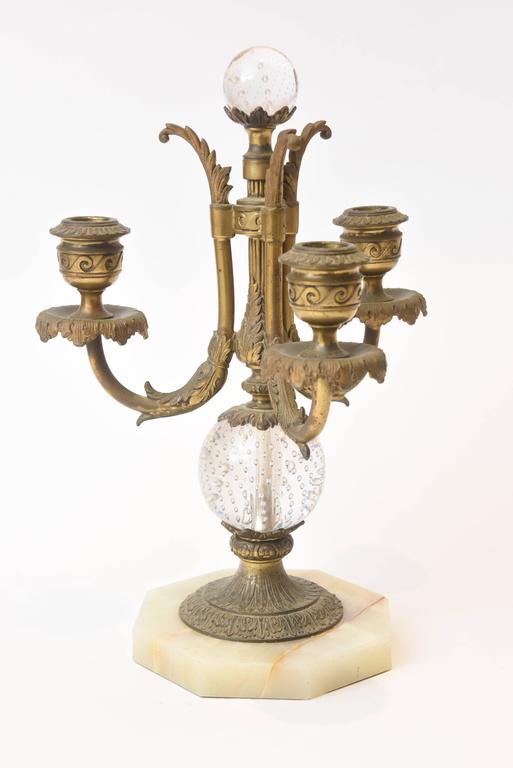
You are a GUI agent. You are given a task and a screenshot of the screen. Output one action in this format:
    pyautogui.click(x=<x>, y=<y>)
    Task: Click on the gold bowls
    
    Given the screenshot: What is the action you would take?
    tap(327, 306), tap(83, 273), tap(377, 257)